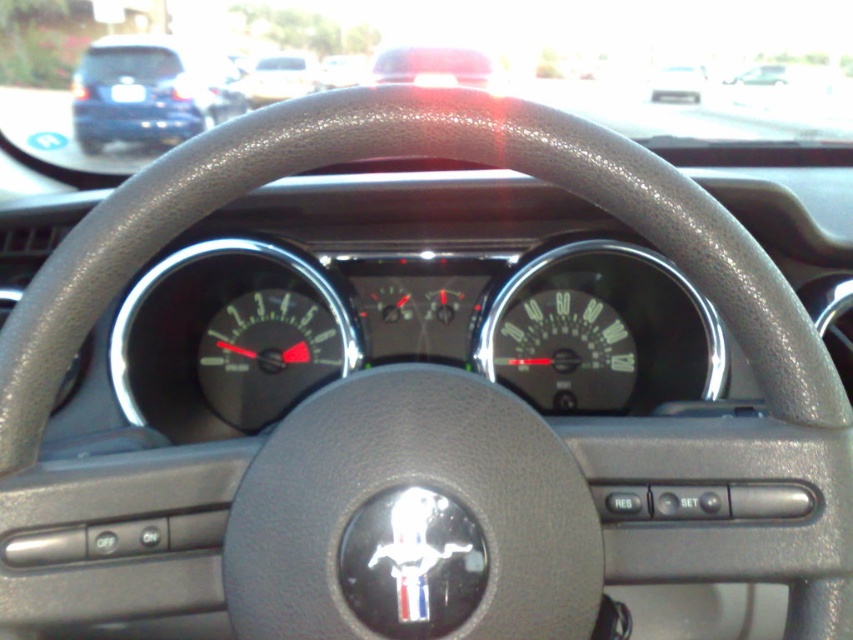
Question: Is black plastic speedometer at center positioned in front of white matte car at upper center?

Choices:
 (A) no
 (B) yes

Answer: (B)

Question: Can you confirm if matte black car at upper left is smaller than white matte car at upper center?

Choices:
 (A) yes
 (B) no

Answer: (B)

Question: Can you confirm if black leather steering wheel at center is positioned to the left of black plastic speedometer at center?

Choices:
 (A) yes
 (B) no

Answer: (B)

Question: Among these points, which one is nearest to the camera?

Choices:
 (A) (206, 388)
 (B) (175, 76)
 (C) (426, 426)

Answer: (C)

Question: Which is nearer to the black matte speedometer at center?

Choices:
 (A) matte black car at upper left
 (B) white matte car at upper center

Answer: (A)

Question: Estimate the real-world distances between objects in this image. Which object is farther from the metallic silver car at upper center?

Choices:
 (A) black leather steering wheel at center
 (B) black matte speedometer at center
 (C) white matte car at upper center

Answer: (A)